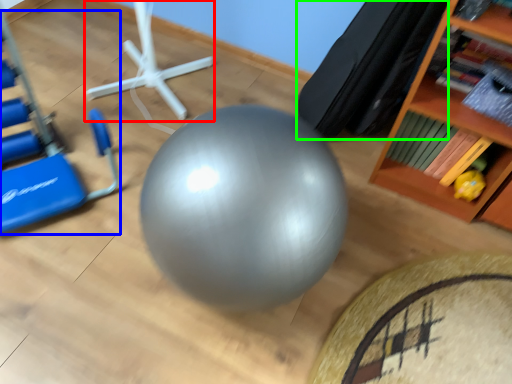
Question: Which is nearer to the sport equipment (highlighted by a red box)? swivel chair (highlighted by a blue box) or bean bag chair (highlighted by a green box).

Choices:
 (A) swivel chair
 (B) bean bag chair

Answer: (A)